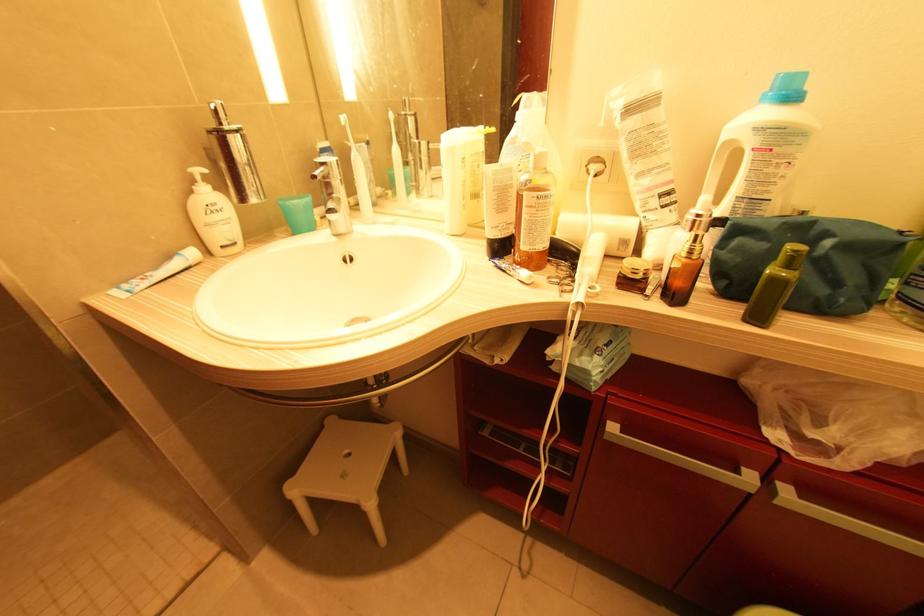
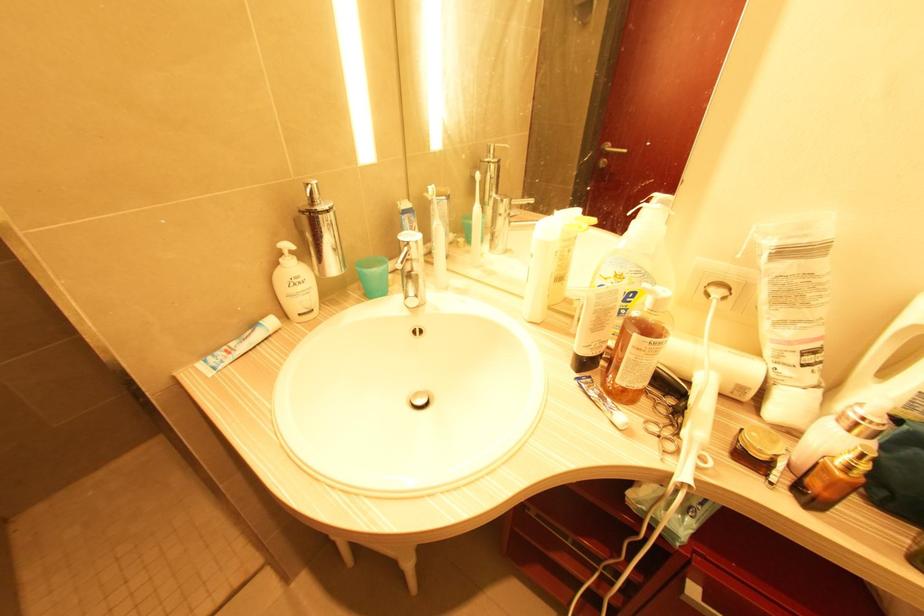
In the second image, find the point that corresponds to (323,169) in the first image.

(407, 249)